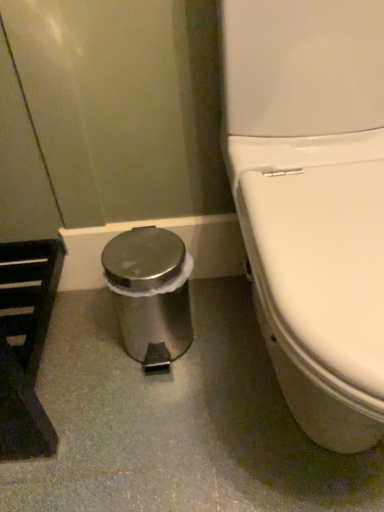
Question: Should I look upward or downward to see polished stainless steel trash can at lower left?

Choices:
 (A) down
 (B) up

Answer: (A)